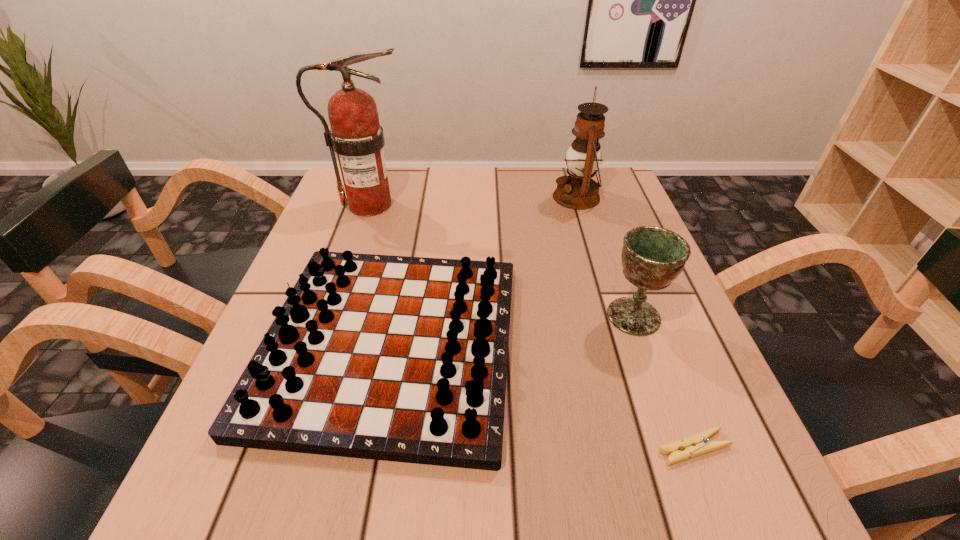
Locate an element on the screen. Image resolution: width=960 pixels, height=540 pixels. the tallest object is located at coordinates (356, 136).

Locate an element on the screen. the second tallest object is located at coordinates (578, 191).

This screenshot has height=540, width=960. Find the location of `the third tallest object`. the third tallest object is located at coordinates (652, 257).

At what (x,y) coordinates should I click in order to perform the action: click on chessboard. Please return your answer as a coordinate pair (x, y). Looking at the image, I should click on (395, 358).

Locate an element on the screen. The width and height of the screenshot is (960, 540). clothespin is located at coordinates (698, 444).

This screenshot has width=960, height=540. In order to click on vacant point located 0.060m at the nozzle of the tallest object in this screenshot , I will do `click(435, 205)`.

Find the location of a particular element. This screenshot has width=960, height=540. vacant space located on the side of the fourth shortest object, there is a wick adjustment knob is located at coordinates (489, 197).

At what (x,y) coordinates should I click in order to perform the action: click on vacant area situated 0.110m on the side of the fourth shortest object, there is a wick adjustment knob. Please return your answer as a coordinate pair (x, y). Image resolution: width=960 pixels, height=540 pixels. Looking at the image, I should click on (511, 197).

At what (x,y) coordinates should I click in order to perform the action: click on vacant region located 0.170m on the side of the fourth shortest object, there is a wick adjustment knob. Please return your answer as a coordinate pair (x, y). This screenshot has height=540, width=960. Looking at the image, I should click on (489, 197).

Identify the location of free space located on the left of the chalice. The width and height of the screenshot is (960, 540). (501, 316).